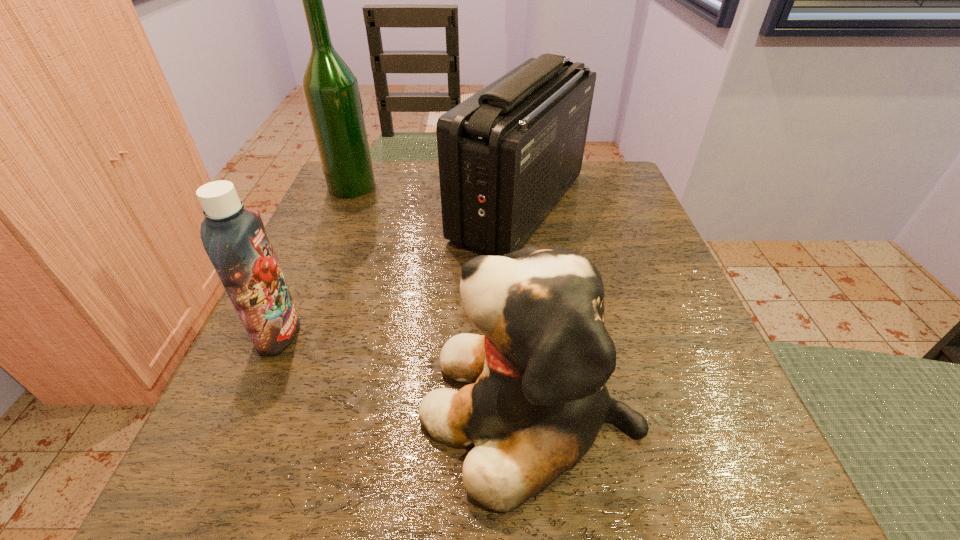
Locate an element on the screen. Image resolution: width=960 pixels, height=540 pixels. the tallest object is located at coordinates (331, 91).

Identify the location of radio receiver. (507, 155).

This screenshot has width=960, height=540. Identify the location of shampoo. (235, 239).

Identify the location of puppy. The width and height of the screenshot is (960, 540). (538, 400).

Identify the location of vacant point located 0.210m on the right of the alcohol. (463, 186).

Locate an element on the screen. vacant space located on the front panel of the radio receiver is located at coordinates (354, 206).

Locate an element on the screen. The height and width of the screenshot is (540, 960). free point located on the front panel of the radio receiver is located at coordinates (358, 206).

Locate an element on the screen. The image size is (960, 540). vacant space situated 0.270m on the front panel of the radio receiver is located at coordinates (327, 206).

At what (x,y) coordinates should I click in order to perform the action: click on free spot located 0.210m on the front label of the shampoo. Please return your answer as a coordinate pair (x, y). Image resolution: width=960 pixels, height=540 pixels. Looking at the image, I should click on pos(429,333).

The height and width of the screenshot is (540, 960). Find the location of `free space located 0.270m at the face of the puppy`. free space located 0.270m at the face of the puppy is located at coordinates (227, 408).